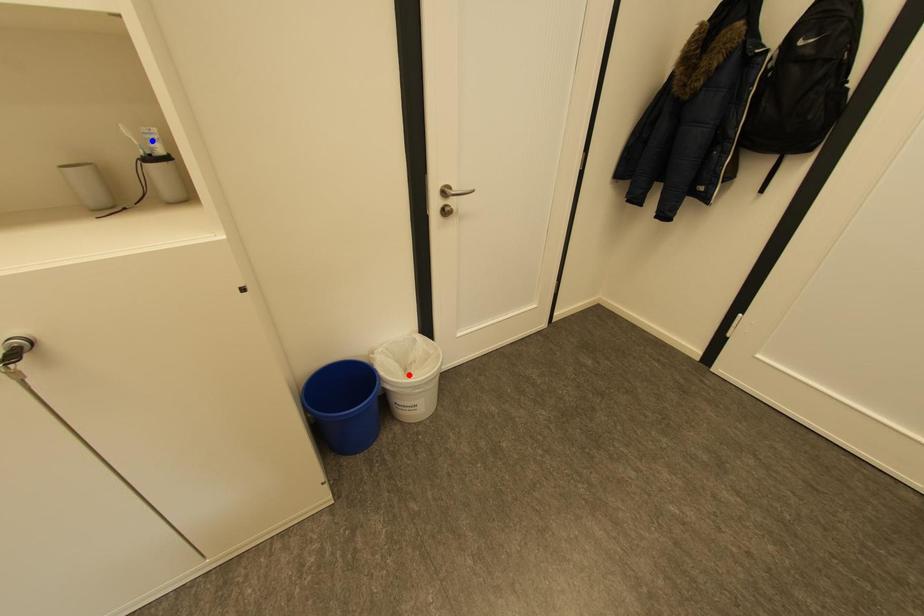
Question: Which of the two points in the image is closer to the camera?

Choices:
 (A) Blue point is closer.
 (B) Red point is closer.

Answer: (A)